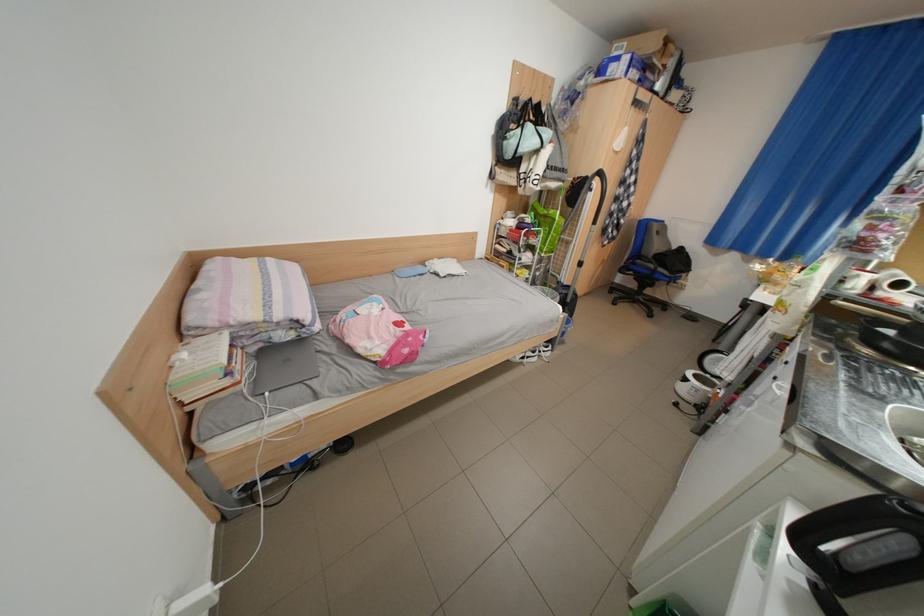
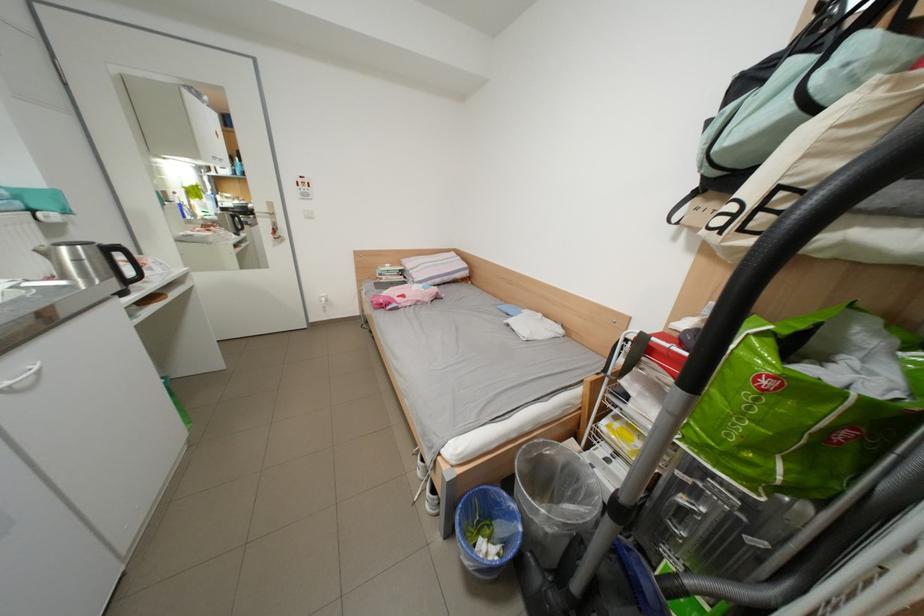
Locate, in the second image, the point that corresponds to the point at 552,147 in the first image.

(801, 111)